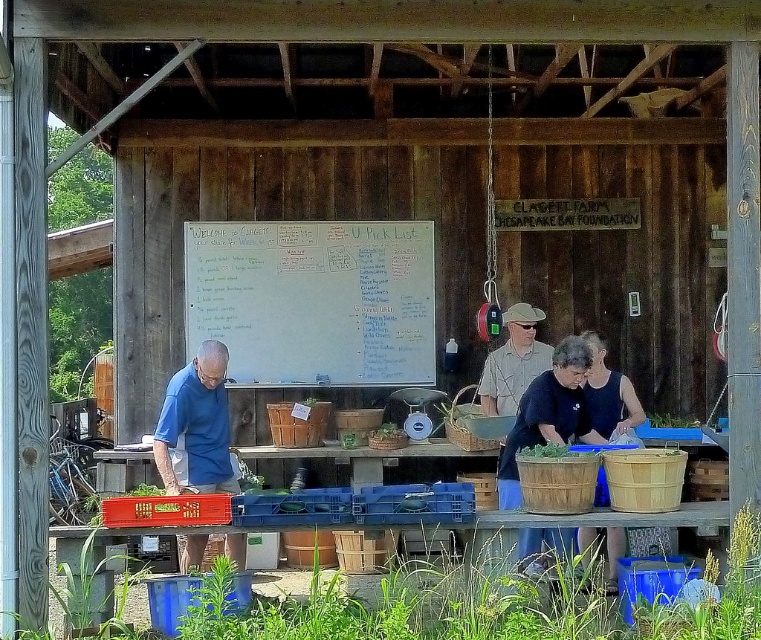
Question: Can you confirm if wooden baskets at center is thinner than matte brown basket at center?

Choices:
 (A) no
 (B) yes

Answer: (A)

Question: Among these points, which one is nearest to the camera?

Choices:
 (A) (591, 374)
 (B) (508, 456)
 (C) (196, 436)

Answer: (B)

Question: Can you confirm if matte blue shirt at left is positioned below matte brown basket at center?

Choices:
 (A) no
 (B) yes

Answer: (B)

Question: Is whiteboard at center positioned behind matte blue shirt at left?

Choices:
 (A) yes
 (B) no

Answer: (A)

Question: Among these objects, which one is nearest to the camera?

Choices:
 (A) whiteboard at center
 (B) wooden baskets at center
 (C) matte brown basket at center
 (D) matte blue shirt at left

Answer: (D)

Question: Which of the following is the farthest from the observer?

Choices:
 (A) matte blue shirt at left
 (B) wooden baskets at center

Answer: (B)